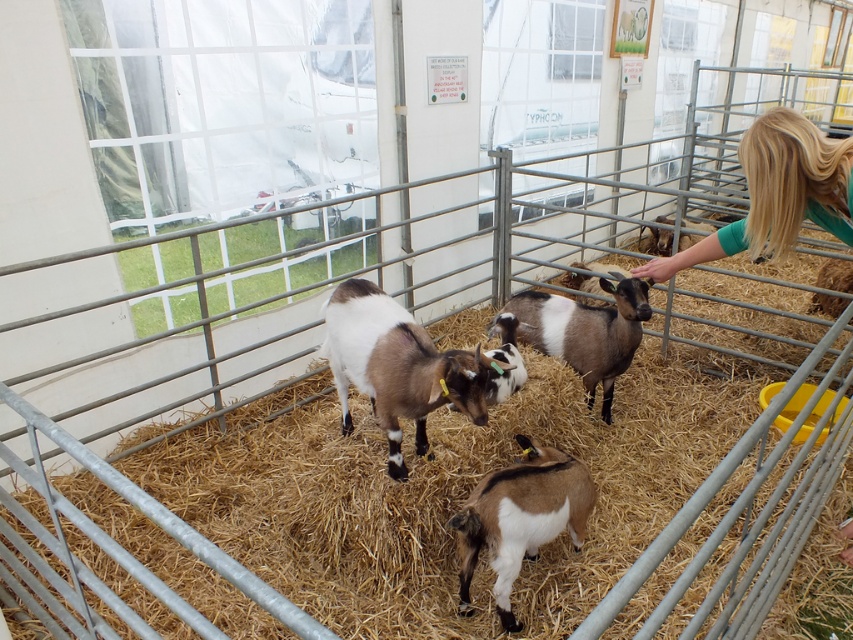
Question: Can you confirm if brown straw at center is smaller than brown and white fur goat at center?

Choices:
 (A) yes
 (B) no

Answer: (B)

Question: Which object is closer to the camera taking this photo?

Choices:
 (A) brown fuzzy goat at center
 (B) brown speckled fur at center
 (C) blonde hair at right

Answer: (C)

Question: Is brown and white fur goat at center further to camera compared to brown speckled fur at center?

Choices:
 (A) yes
 (B) no

Answer: (B)

Question: Which object is closer to the camera taking this photo?

Choices:
 (A) brown fuzzy goat at center
 (B) brown speckled fur at center
 (C) blonde hair at right

Answer: (C)

Question: Can you confirm if brown and white fur goat at center is smaller than brown speckled fur at center?

Choices:
 (A) no
 (B) yes

Answer: (B)

Question: Which object is positioned farthest from the brown straw at center?

Choices:
 (A) brown speckled fur at center
 (B) blonde hair at right
 (C) brown and white fur goat at center

Answer: (B)